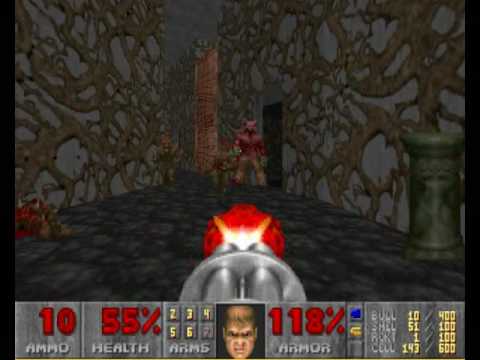
I want to click on black walls with vines, so click(326, 106), click(94, 111).